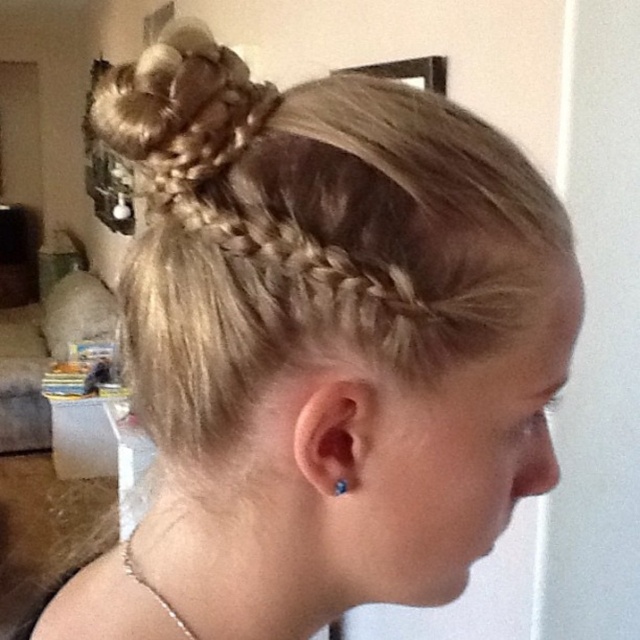
Can you confirm if golden braided hair at upper center is positioned to the right of blue pearl earring at ear?

Incorrect, golden braided hair at upper center is not on the right side of blue pearl earring at ear.

Is golden braided hair at upper center shorter than blue pearl earring at ear?

No.

At what (x,y) coordinates should I click in order to perform the action: click on golden braided hair at upper center. Please return your answer as a coordinate pair (x, y). Looking at the image, I should click on (227, 168).

Which is behind, point (186, 106) or point (182, 624)?

The point (182, 624) is more distant.

Can you confirm if golden braided hair at upper center is taller than silver chain necklace at lower left?

Yes, golden braided hair at upper center is taller than silver chain necklace at lower left.

Where is `golden braided hair at upper center`? This screenshot has height=640, width=640. golden braided hair at upper center is located at coordinates (227, 168).

From the picture: Who is higher up, silver chain necklace at lower left or blue pearl earring at ear?

Positioned higher is blue pearl earring at ear.

Which is behind, point (150, 582) or point (336, 493)?

Positioned behind is point (150, 582).

Identify the location of silver chain necklace at lower left. The image size is (640, 640). 150,588.